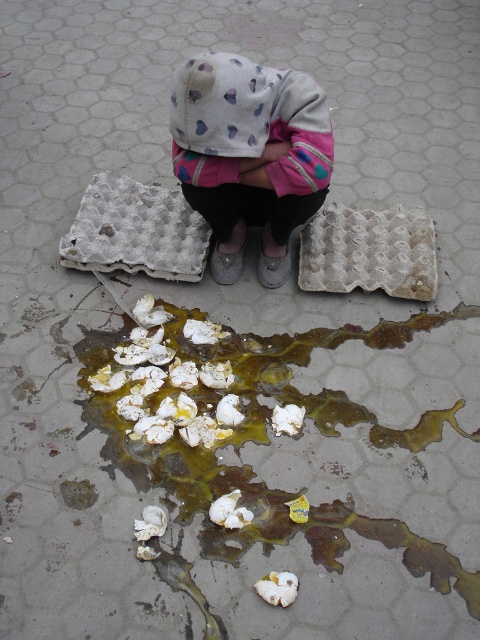
Question: Does white crumbly eggshells at lower center have a smaller size compared to white cardboard egg carton at lower center?

Choices:
 (A) yes
 (B) no

Answer: (B)

Question: Is white cotton hoodie at center further to camera compared to white cardboard egg carton at center?

Choices:
 (A) yes
 (B) no

Answer: (B)

Question: Among these points, which one is nearest to the camera?

Choices:
 (A) (354, 260)
 (B) (194, 77)
 (C) (181, 324)
 (D) (163, 253)

Answer: (B)

Question: Where is white cotton hoodie at center located in relation to white cardboard egg carton at lower center in the image?

Choices:
 (A) left
 (B) right

Answer: (A)

Question: Among these points, which one is farthest from the camera?

Choices:
 (A) [x=64, y=246]
 (B) [x=274, y=369]

Answer: (A)

Question: Which object appears closest to the camera in this image?

Choices:
 (A) white cotton hoodie at center
 (B) white cardboard egg carton at lower center

Answer: (A)